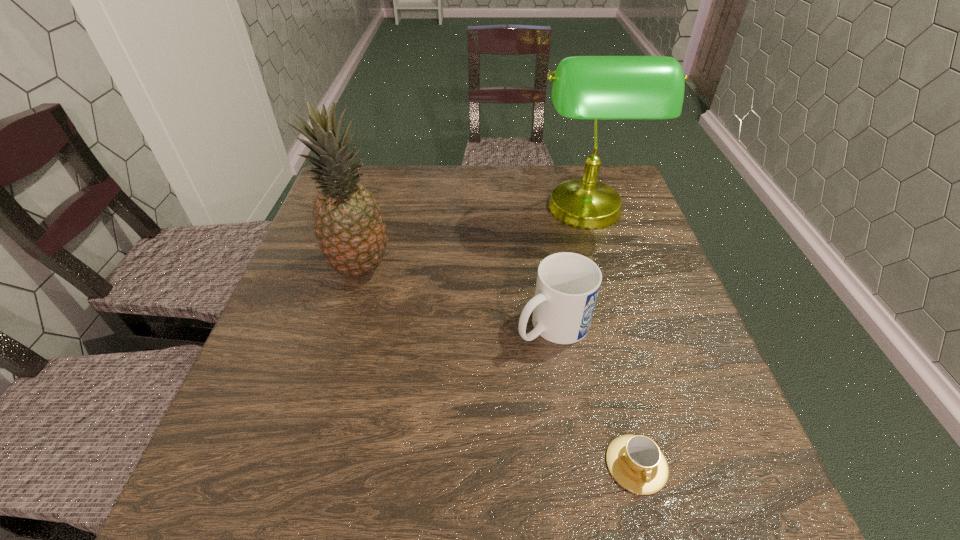
Image resolution: width=960 pixels, height=540 pixels. I want to click on free spot between the shortest object and the pineapple, so 498,366.

The height and width of the screenshot is (540, 960). What are the coordinates of `empty space between the third nearest object and the mug` in the screenshot? It's located at (456, 297).

This screenshot has height=540, width=960. I want to click on free space between the farthest object and the cup, so click(612, 338).

Locate an element on the screen. The height and width of the screenshot is (540, 960). vacant area between the mug and the nearest object is located at coordinates (594, 395).

Locate an element on the screen. The height and width of the screenshot is (540, 960). object identified as the third closest to the pineapple is located at coordinates (635, 461).

Identify the location of object identified as the closest to the farthest object. Image resolution: width=960 pixels, height=540 pixels. (567, 286).

This screenshot has height=540, width=960. Identify the location of free space that satisfies the following two spatial constraints: 1. on the desk next to the lamp; 2. with the handle on the side of the cup. (660, 464).

At what (x,y) coordinates should I click in order to perform the action: click on vacant space that satisfies the following two spatial constraints: 1. on the desk next to the lamp; 2. with the handle on the side of the cup. Please return your answer as a coordinate pair (x, y). This screenshot has width=960, height=540. Looking at the image, I should click on (660, 464).